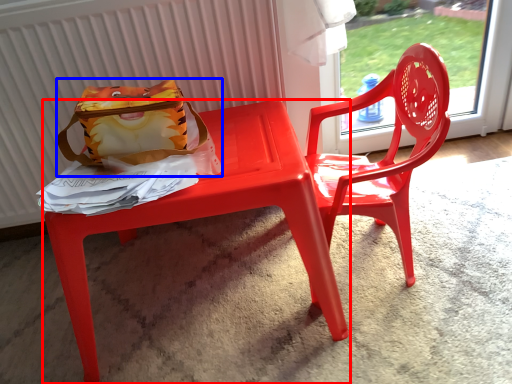
Question: Which object is closer to the camera taking this photo, table (highlighted by a red box) or pouch (highlighted by a blue box)?

Choices:
 (A) table
 (B) pouch

Answer: (A)